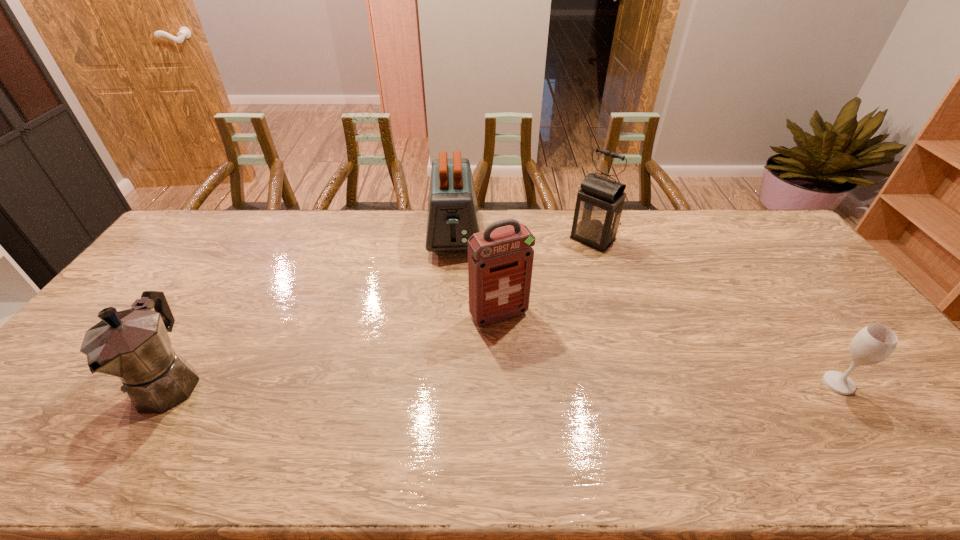
At what (x,y) coordinates should I click in order to perform the action: click on free point located 0.050m on the front-facing side of the fourth object from left to right. Please return your answer as a coordinate pair (x, y). This screenshot has height=540, width=960. Looking at the image, I should click on (574, 257).

The image size is (960, 540). Identify the location of vacant position located on the front-facing side of the fourth object from left to right. (544, 285).

Where is `free region located 0.120m on the front-facing side of the fourth object from left to right`? The height and width of the screenshot is (540, 960). free region located 0.120m on the front-facing side of the fourth object from left to right is located at coordinates (563, 267).

The width and height of the screenshot is (960, 540). I want to click on vacant space located on the front-facing side of the toaster, so click(x=455, y=327).

The height and width of the screenshot is (540, 960). Identify the location of free space located on the front-facing side of the toaster. (454, 316).

Locate an element on the screen. This screenshot has height=540, width=960. vacant position located on the front-facing side of the toaster is located at coordinates (454, 278).

Find the location of `lantern situated at the far edge`. lantern situated at the far edge is located at coordinates [x=599, y=205].

Where is `toaster that is at the far edge`? The image size is (960, 540). toaster that is at the far edge is located at coordinates click(x=452, y=218).

Find the location of `coffeepot positioned at the near edge`. coffeepot positioned at the near edge is located at coordinates (133, 345).

Locate an element on the screen. Image resolution: width=960 pixels, height=540 pixels. wineglass present at the near edge is located at coordinates (874, 343).